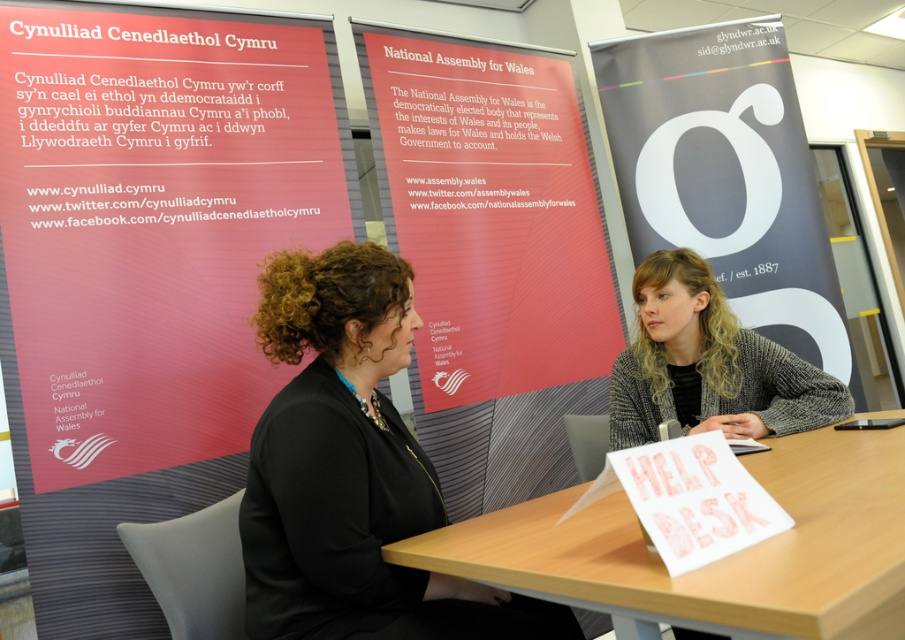
You are an interior designer planning to add a new decorative element to the help desk area. The scene currently has a matte red banner at center and a gray woolen sweater at center. Which object would you recommend placing a small accent light beside to highlight its size, and why?

The matte red banner at center is bigger than the gray woolen sweater at center, so placing the accent light beside the matte red banner at center would better highlight its larger size.

You are organizing a conference and need to place two banners in the room. The scene shows a matte red banner at center and a matte gray banner at center. According to the image, which banner is positioned to the left of the other?

The matte red banner at center is positioned on the left side of the matte gray banner at center.